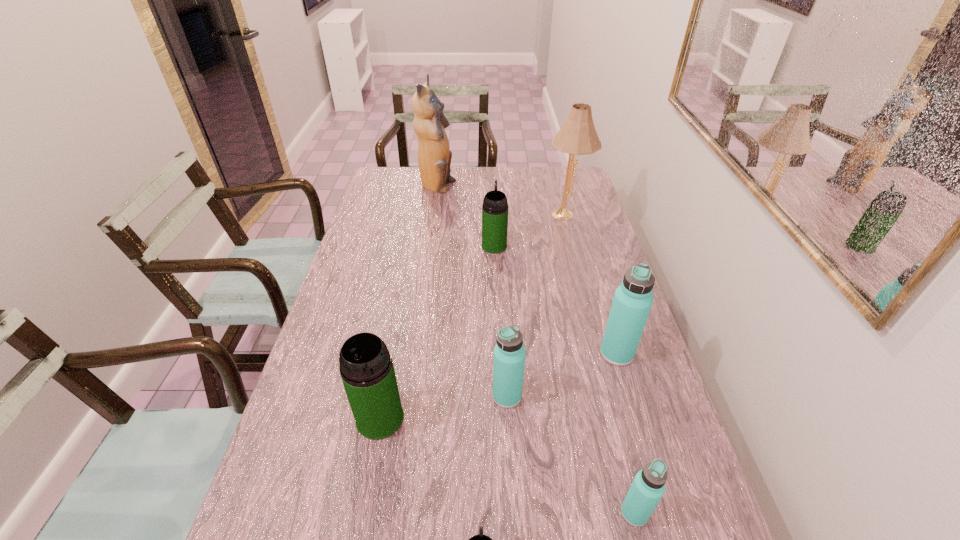
Locate which green thermos bottle ranks second in proximity to the leftmost aqua thermos bottle. Please provide its 2D coordinates. Your answer should be formatted as a tuple, i.e. [(x, y)], where the tuple contains the x and y coordinates of a point satisfying the conditions above.

[(480, 539)]

Choose which aqua thermos bottle is the nearest neighbor to the smallest aqua thermos bottle. Please provide its 2D coordinates. Your answer should be formatted as a tuple, i.e. [(x, y)], where the tuple contains the x and y coordinates of a point satisfying the conditions above.

[(509, 353)]

Locate an element on the screen. The image size is (960, 540). aqua thermos bottle that stands as the closest to the beige lampshade is located at coordinates (633, 299).

Locate an element on the screen. The height and width of the screenshot is (540, 960). vacant space that satisfies the following two spatial constraints: 1. on the face of the cat; 2. from the spout of the second biggest green thermos bottle is located at coordinates (428, 246).

This screenshot has width=960, height=540. What are the coordinates of `free space that satisfies the following two spatial constraints: 1. on the front side of the second nearest object; 2. on the left side of the leftmost aqua thermos bottle` in the screenshot? It's located at (513, 513).

Where is `vacant space that satisfies the following two spatial constraints: 1. from the spout of the leftmost thermos bottle; 2. on the left side of the smallest aqua thermos bottle`? This screenshot has height=540, width=960. vacant space that satisfies the following two spatial constraints: 1. from the spout of the leftmost thermos bottle; 2. on the left side of the smallest aqua thermos bottle is located at coordinates (362, 513).

Identify the location of free space that satisfies the following two spatial constraints: 1. on the face of the biggest aqua thermos bottle; 2. on the left side of the cat. The image size is (960, 540). (413, 354).

Find the location of a particular element. The width and height of the screenshot is (960, 540). vacant space that satisfies the following two spatial constraints: 1. from the spout of the second smallest green thermos bottle; 2. on the left side of the lampshade is located at coordinates (493, 214).

The height and width of the screenshot is (540, 960). Find the location of `free space that satisfies the following two spatial constraints: 1. from the spout of the farthest green thermos bottle; 2. on the face of the cat`. free space that satisfies the following two spatial constraints: 1. from the spout of the farthest green thermos bottle; 2. on the face of the cat is located at coordinates (492, 187).